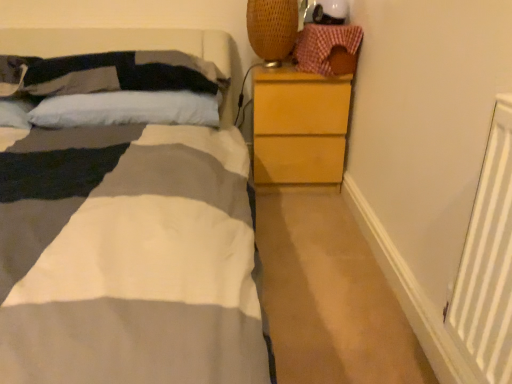
Question: Considering the relative sizes of checkered fabric basket at upper right and soft cotton pillow at upper left, the 1th pillow positioned from the top, in the image provided, is checkered fabric basket at upper right wider than soft cotton pillow at upper left, the 1th pillow positioned from the top,?

Choices:
 (A) yes
 (B) no

Answer: (B)

Question: From a real-world perspective, does checkered fabric basket at upper right sit lower than soft cotton pillow at upper left, the 2th pillow in the bottom-to-top sequence?

Choices:
 (A) no
 (B) yes

Answer: (A)

Question: Is checkered fabric basket at upper right at the right side of soft cotton pillow at upper left, the 2th pillow in the bottom-to-top sequence?

Choices:
 (A) no
 (B) yes

Answer: (B)

Question: Can you confirm if checkered fabric basket at upper right is bigger than soft cotton pillow at upper left, the 1th pillow positioned from the top?

Choices:
 (A) yes
 (B) no

Answer: (B)

Question: Does checkered fabric basket at upper right contain soft cotton pillow at upper left, the 1th pillow positioned from the top?

Choices:
 (A) no
 (B) yes

Answer: (A)

Question: Is checkered fabric basket at upper right not inside soft cotton pillow at upper left, the 1th pillow positioned from the top?

Choices:
 (A) no
 (B) yes

Answer: (B)

Question: From a real-world perspective, is white soft pillow at upper left, acting as the 2th pillow starting from the top, under checkered fabric basket at upper right?

Choices:
 (A) yes
 (B) no

Answer: (A)

Question: Is white soft pillow at upper left, acting as the 2th pillow starting from the top, positioned before checkered fabric basket at upper right?

Choices:
 (A) yes
 (B) no

Answer: (A)

Question: From a real-world perspective, is white soft pillow at upper left, acting as the 2th pillow starting from the top, located higher than checkered fabric basket at upper right?

Choices:
 (A) no
 (B) yes

Answer: (A)

Question: Does white soft pillow at upper left, the first pillow positioned from the bottom, turn towards checkered fabric basket at upper right?

Choices:
 (A) no
 (B) yes

Answer: (A)

Question: Is white soft pillow at upper left, acting as the 2th pillow starting from the top, outside of checkered fabric basket at upper right?

Choices:
 (A) no
 (B) yes

Answer: (B)

Question: Is white soft pillow at upper left, acting as the 2th pillow starting from the top, looking in the opposite direction of checkered fabric basket at upper right?

Choices:
 (A) no
 (B) yes

Answer: (A)

Question: From a real-world perspective, does checkered fabric basket at upper right stand above white soft pillow at upper left, the first pillow positioned from the bottom?

Choices:
 (A) no
 (B) yes

Answer: (B)